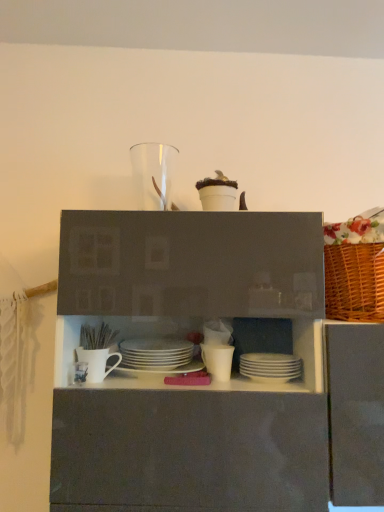
Question: Could you tell me if transparent glass vase at upper center, placed as the third tableware when sorted from left to right, is turned towards white matte plates at center, which is the 6th tableware from left to right?

Choices:
 (A) yes
 (B) no

Answer: (B)

Question: Is transparent glass vase at upper center, the fourth tableware viewed from the right, positioned in front of white matte plates at center, which is the 6th tableware from left to right?

Choices:
 (A) no
 (B) yes

Answer: (A)

Question: From a real-world perspective, does transparent glass vase at upper center, the fourth tableware viewed from the right, sit lower than white matte plates at center, the 1th tableware ordered from the bottom?

Choices:
 (A) no
 (B) yes

Answer: (A)

Question: Is white matte plates at center, the sixth tableware positioned from the top, completely or partially inside transparent glass vase at upper center, the fourth tableware viewed from the right?

Choices:
 (A) yes
 (B) no

Answer: (B)

Question: Considering the relative sizes of transparent glass vase at upper center, which is counted as the 6th tableware, starting from the bottom, and white matte plates at center, the 1th tableware ordered from the bottom, in the image provided, is transparent glass vase at upper center, which is counted as the 6th tableware, starting from the bottom, shorter than white matte plates at center, the 1th tableware ordered from the bottom,?

Choices:
 (A) yes
 (B) no

Answer: (B)

Question: Is transparent glass vase at upper center, the fourth tableware viewed from the right, at the left side of white matte plates at center, which appears as the 1th tableware when viewed from the right?

Choices:
 (A) no
 (B) yes

Answer: (B)

Question: From a real-world perspective, is transparent glass vase at upper center, which is counted as the 6th tableware, starting from the bottom, physically above white matte cup at center, the fifth tableware positioned from the left?

Choices:
 (A) yes
 (B) no

Answer: (A)

Question: Is transparent glass vase at upper center, positioned as the first tableware in top-to-bottom order, at the right side of white matte cup at center, which is the fifth tableware in top-to-bottom order?

Choices:
 (A) yes
 (B) no

Answer: (B)

Question: Does transparent glass vase at upper center, placed as the third tableware when sorted from left to right, have a greater height compared to white matte cup at center, the fifth tableware positioned from the left?

Choices:
 (A) yes
 (B) no

Answer: (A)

Question: Is transparent glass vase at upper center, the fourth tableware viewed from the right, facing towards white matte cup at center, the second tableware from the right?

Choices:
 (A) yes
 (B) no

Answer: (B)

Question: Is transparent glass vase at upper center, positioned as the first tableware in top-to-bottom order, at the left side of white matte cup at center, which is the fifth tableware in top-to-bottom order?

Choices:
 (A) no
 (B) yes

Answer: (B)

Question: Is transparent glass vase at upper center, which is counted as the 6th tableware, starting from the bottom, positioned before white matte cup at center, the fifth tableware positioned from the left?

Choices:
 (A) yes
 (B) no

Answer: (B)

Question: Is white glossy plates at center, which is the fourth tableware from left to right, smaller than white matte mug at center, positioned as the fifth tableware in bottom-to-top order?

Choices:
 (A) yes
 (B) no

Answer: (B)